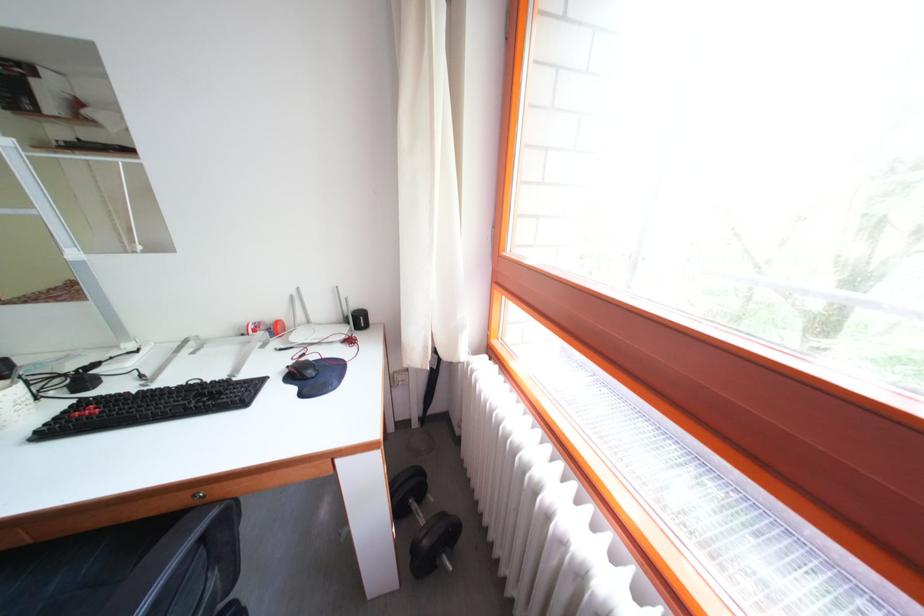
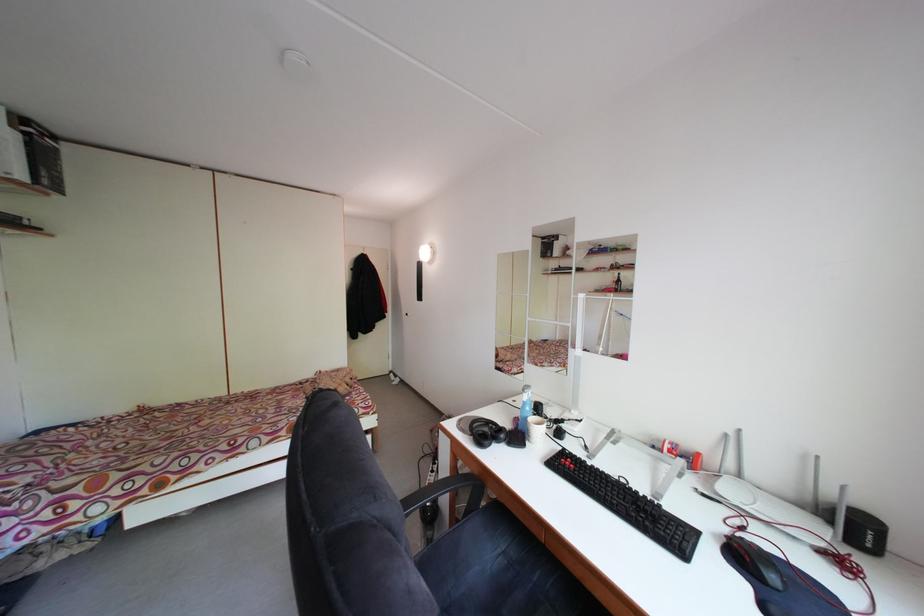
In the second image, find the point that corresponds to the point at 298,370 in the first image.

(735, 536)